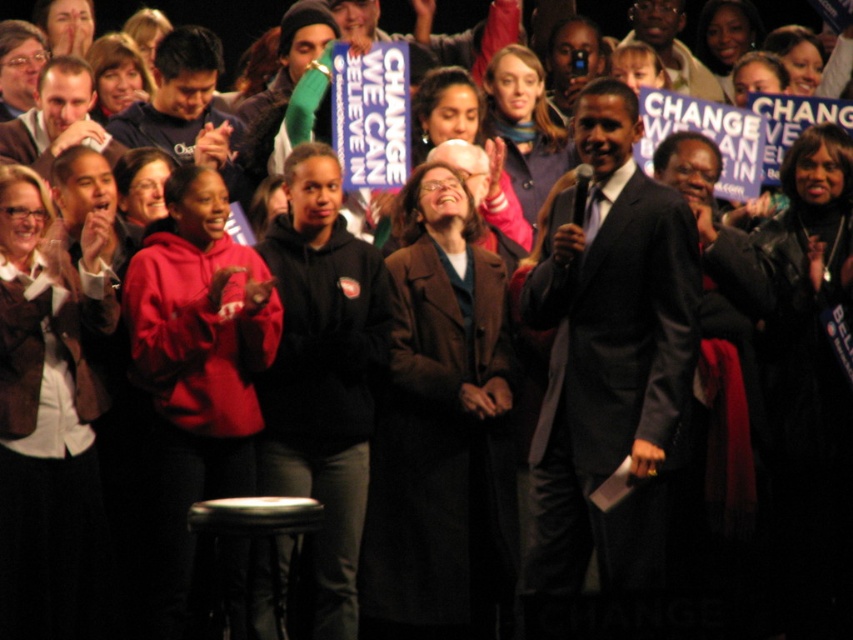
Question: Among these points, which one is nearest to the camera?

Choices:
 (A) (245, 528)
 (B) (183, 492)

Answer: (A)

Question: Can you confirm if red hoodie at center is bigger than matte brown coat at center?

Choices:
 (A) yes
 (B) no

Answer: (B)

Question: Which of these objects is positioned closest to the red hoodie at center?

Choices:
 (A) brown leather jacket at center
 (B) matte black hoodie at upper left
 (C) matte brown coat at center

Answer: (A)

Question: Among these points, which one is farthest from the camera?

Choices:
 (A) (129, 273)
 (B) (534, 182)
 (C) (4, 566)
 (D) (230, 525)

Answer: (B)

Question: Can you confirm if brown leather jacket at center is positioned to the left of red hoodie at center?

Choices:
 (A) yes
 (B) no

Answer: (A)

Question: Observing the image, what is the correct spatial positioning of brown leather jacket at center in reference to black leather stool at lower center?

Choices:
 (A) below
 (B) above

Answer: (B)